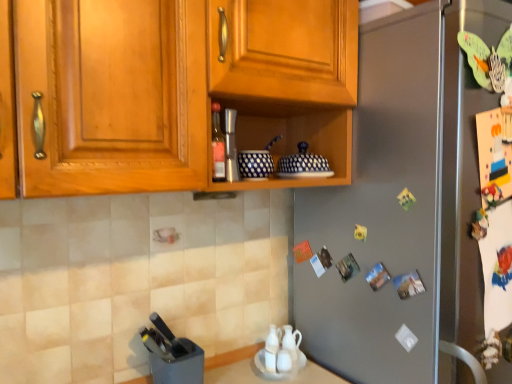
In the scene shown: Measure the distance between point (x=220, y=145) and camera.

Point (x=220, y=145) is 38.07 inches from camera.

This screenshot has width=512, height=384. Describe the element at coordinates (231, 145) in the screenshot. I see `brushed metal shaker at center, marked as the third appliance in a bottom-to-top arrangement` at that location.

What is the approximate height of brushed metal shaker at center, placed as the second appliance when sorted from left to right?

brushed metal shaker at center, placed as the second appliance when sorted from left to right, is 6.80 inches in height.

What do you see at coordinates (179, 366) in the screenshot? Image resolution: width=512 pixels, height=384 pixels. I see `black plastic knife block at lower left, which ranks as the 3th appliance in right-to-left order` at bounding box center [179, 366].

What do you see at coordinates (255, 164) in the screenshot? The image size is (512, 384). I see `blue dotted ceramic bowls at center, which is the 2th appliance from top to bottom` at bounding box center [255, 164].

Where is `matte glass bottle at center`? Image resolution: width=512 pixels, height=384 pixels. matte glass bottle at center is located at coordinates (218, 145).

Does white glossy tea pot at lower center have a smaller size compared to wooden cabinet at upper center?

Yes.

Does white glossy tea pot at lower center appear on the left side of wooden cabinet at upper center?

No, white glossy tea pot at lower center is not to the left of wooden cabinet at upper center.

In terms of height, does white glossy tea pot at lower center look taller or shorter compared to wooden cabinet at upper center?

white glossy tea pot at lower center is shorter than wooden cabinet at upper center.

Considering the sizes of objects matte glass bottle at center and black plastic knife block at lower left, acting as the first appliance starting from the bottom, in the image provided, who is wider, matte glass bottle at center or black plastic knife block at lower left, acting as the first appliance starting from the bottom,?

black plastic knife block at lower left, acting as the first appliance starting from the bottom, is wider.

Are matte glass bottle at center and black plastic knife block at lower left, marked as the 3th appliance in a top-to-bottom arrangement, located far from each other?

No, matte glass bottle at center is in close proximity to black plastic knife block at lower left, marked as the 3th appliance in a top-to-bottom arrangement.

Locate an element on the screen. Image resolution: width=512 pixels, height=384 pixels. the 3rd appliance positioned below the matte glass bottle at center (from a real-world perspective) is located at coordinates (179, 366).

How different are the orientations of matte glass bottle at center and black plastic knife block at lower left, which ranks as the 3th appliance in right-to-left order, in degrees?

The facing directions of matte glass bottle at center and black plastic knife block at lower left, which ranks as the 3th appliance in right-to-left order, are 1.18 degrees apart.

Considering the positions of point (454, 42) and point (55, 2), is point (454, 42) closer or farther from the camera than point (55, 2)?

Clearly, point (454, 42) is more distant from the camera than point (55, 2).

Is satin silver refrigerator at center completely or partially outside of wooden cabinet at upper center?

Absolutely, satin silver refrigerator at center is external to wooden cabinet at upper center.

From the image's perspective, is satin silver refrigerator at center located above or below wooden cabinet at upper center?

Clearly, from the image's perspective, satin silver refrigerator at center is below wooden cabinet at upper center.

Is the position of satin silver refrigerator at center less distant than that of wooden cabinet at upper center?

No, satin silver refrigerator at center is further to the viewer.

Is blue dotted ceramic bowls at center, the 3th appliance positioned from the left, completely or partially inside white glossy tea pot at lower center?

Definitely not — blue dotted ceramic bowls at center, the 3th appliance positioned from the left, is not inside white glossy tea pot at lower center.

Is white glossy tea pot at lower center touching blue dotted ceramic bowls at center, which is the 2th appliance from top to bottom?

No, white glossy tea pot at lower center is not making contact with blue dotted ceramic bowls at center, which is the 2th appliance from top to bottom.

From the image's perspective, which is above, white glossy tea pot at lower center or blue dotted ceramic bowls at center, the 1th appliance positioned from the right?

From the image's view, blue dotted ceramic bowls at center, the 1th appliance positioned from the right, is above.

From a real-world perspective, is white glossy tea pot at lower center below blue dotted ceramic bowls at center, the 1th appliance positioned from the right?

Yes, from a real-world perspective, white glossy tea pot at lower center is under blue dotted ceramic bowls at center, the 1th appliance positioned from the right.

How distant is blue dotted ceramic bowls at center, the 1th appliance positioned from the right, from satin silver refrigerator at center?

They are 16.40 inches apart.

How different are the orientations of blue dotted ceramic bowls at center, which is the 2th appliance from top to bottom, and satin silver refrigerator at center in degrees?

1.17 degrees.

From the image's perspective, which is below, blue dotted ceramic bowls at center, the 3th appliance positioned from the left, or satin silver refrigerator at center?

satin silver refrigerator at center appears lower in the image.

Considering the sizes of objects blue dotted ceramic bowls at center, which ranks as the second appliance in bottom-to-top order, and satin silver refrigerator at center in the image provided, who is smaller, blue dotted ceramic bowls at center, which ranks as the second appliance in bottom-to-top order, or satin silver refrigerator at center?

With smaller size is blue dotted ceramic bowls at center, which ranks as the second appliance in bottom-to-top order.

Does satin silver refrigerator at center have a smaller size compared to brushed metal shaker at center, arranged as the 2th appliance when viewed from the right?

Incorrect, satin silver refrigerator at center is not smaller in size than brushed metal shaker at center, arranged as the 2th appliance when viewed from the right.

Between satin silver refrigerator at center and brushed metal shaker at center, placed as the second appliance when sorted from left to right, which one has smaller width?

With smaller width is brushed metal shaker at center, placed as the second appliance when sorted from left to right.

Does point (310, 220) appear closer or farther from the camera than point (230, 146)?

Point (310, 220) appears to be farther away from the viewer than point (230, 146).

Considering the positions of objects matte glass bottle at center and wooden cabinet at upper center in the image provided, who is more to the right, matte glass bottle at center or wooden cabinet at upper center?

wooden cabinet at upper center.

Would you say matte glass bottle at center is outside wooden cabinet at upper center?

No, matte glass bottle at center is inside or overlapping with wooden cabinet at upper center.

Is matte glass bottle at center positioned with its back to wooden cabinet at upper center?

Yes, matte glass bottle at center is facing away from wooden cabinet at upper center.

Where is `tea pot lying behind the wooden cabinet at upper center`? The image size is (512, 384). tea pot lying behind the wooden cabinet at upper center is located at coordinates (292, 342).

Where is `appliance on the left of matte glass bottle at center`? Image resolution: width=512 pixels, height=384 pixels. appliance on the left of matte glass bottle at center is located at coordinates (179, 366).

When comparing their distances from wooden cabinet at upper center, does brushed metal shaker at center, placed as the second appliance when sorted from left to right, or satin silver refrigerator at center seem closer?

brushed metal shaker at center, placed as the second appliance when sorted from left to right, is closer to wooden cabinet at upper center.

Considering their positions, is satin silver refrigerator at center positioned closer to white glossy tea pot at lower center than brushed metal shaker at center, placed as the second appliance when sorted from left to right?

Among the two, satin silver refrigerator at center is located nearer to white glossy tea pot at lower center.

Based on the photo, from the image, which object appears to be farther from black plastic knife block at lower left, acting as the first appliance starting from the bottom, matte glass bottle at center or brushed metal shaker at center, marked as the third appliance in a bottom-to-top arrangement?

brushed metal shaker at center, marked as the third appliance in a bottom-to-top arrangement, is positioned further to the anchor black plastic knife block at lower left, acting as the first appliance starting from the bottom.

When comparing their distances from black plastic knife block at lower left, acting as the first appliance starting from the bottom, does matte glass bottle at center or blue dotted ceramic bowls at center, which ranks as the second appliance in bottom-to-top order, seem further?

Among the two, matte glass bottle at center is located further to black plastic knife block at lower left, acting as the first appliance starting from the bottom.

Considering their positions, is wooden cabinet at upper center positioned further to white glossy tea pot at lower center than satin silver refrigerator at center?

wooden cabinet at upper center is positioned further to the anchor white glossy tea pot at lower center.

Based on their spatial positions, is white glossy tea pot at lower center or matte glass bottle at center closer to wooden cabinet at upper center?

matte glass bottle at center lies closer to wooden cabinet at upper center than the other object.

Considering their positions, is brushed metal shaker at center, arranged as the 2th appliance when viewed from the right, positioned closer to wooden cabinet at upper center than white glossy tea pot at lower center?

brushed metal shaker at center, arranged as the 2th appliance when viewed from the right, is positioned closer to the anchor wooden cabinet at upper center.

From the image, which object appears to be farther from blue dotted ceramic bowls at center, which is the 2th appliance from top to bottom, brushed metal shaker at center, the first appliance positioned from the top, or satin silver refrigerator at center?

Based on the image, satin silver refrigerator at center appears to be further to blue dotted ceramic bowls at center, which is the 2th appliance from top to bottom.

Image resolution: width=512 pixels, height=384 pixels. I want to click on refrigerator between wooden cabinet at upper center and white glossy tea pot at lower center vertically, so click(403, 203).

Where is `appliance located between brushed metal shaker at center, the first appliance positioned from the top, and satin silver refrigerator at center in the left-right direction`? This screenshot has width=512, height=384. appliance located between brushed metal shaker at center, the first appliance positioned from the top, and satin silver refrigerator at center in the left-right direction is located at coordinates (255, 164).

Find the location of a particular element. The height and width of the screenshot is (384, 512). cabinetry situated between brushed metal shaker at center, placed as the second appliance when sorted from left to right, and satin silver refrigerator at center from left to right is located at coordinates (179, 89).

At what (x,y) coordinates should I click in order to perform the action: click on appliance between brushed metal shaker at center, placed as the second appliance when sorted from left to right, and black plastic knife block at lower left, marked as the 3th appliance in a top-to-bottom arrangement, from top to bottom. Please return your answer as a coordinate pair (x, y). Looking at the image, I should click on (255, 164).